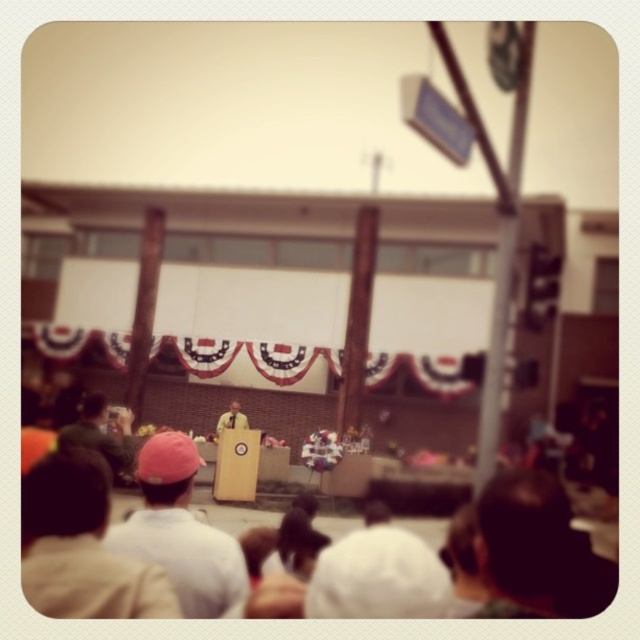
Question: Does white cotton shirt at center appear over khaki cotton shirt at lower left?

Choices:
 (A) yes
 (B) no

Answer: (A)

Question: Can you confirm if white cotton shirt at lower left is positioned to the right of yellow fabric at center?

Choices:
 (A) no
 (B) yes

Answer: (B)

Question: Which object is the closest to the dark brown leather hat at lower right?

Choices:
 (A) white cotton shirt at lower left
 (B) khaki cotton shirt at lower left
 (C) white matte cap at lower left
 (D) white cotton shirt at center

Answer: (D)

Question: Estimate the real-world distances between objects in this image. Which object is closer to the white cotton shirt at center?

Choices:
 (A) khaki cotton shirt at lower left
 (B) white matte cap at lower left
 (C) dark brown leather hat at lower right
 (D) yellow fabric at center

Answer: (C)

Question: Does white cotton shirt at lower left come in front of dark brown leather hat at lower right?

Choices:
 (A) no
 (B) yes

Answer: (B)

Question: Which object appears closest to the camera in this image?

Choices:
 (A) dark brown leather hat at lower right
 (B) khaki cotton shirt at lower left
 (C) white matte cap at lower left

Answer: (A)